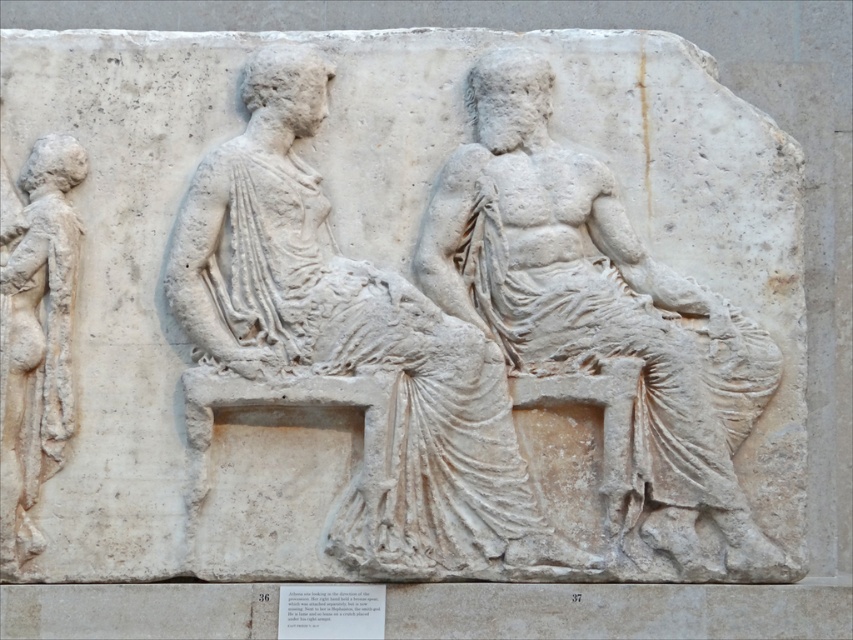
Who is lower down, white marble reclining figure at center or white marble figure at left?

white marble figure at left

Looking at this image, is white marble reclining figure at center to the left of white marble figure at left from the viewer's perspective?

No, white marble reclining figure at center is not to the left of white marble figure at left.

The height and width of the screenshot is (640, 853). What do you see at coordinates (344, 346) in the screenshot?
I see `white marble reclining figure at center` at bounding box center [344, 346].

Find the location of a particular element. This screenshot has width=853, height=640. white marble reclining figure at center is located at coordinates (344, 346).

Who is higher up, white marble figure at center or white marble figure at left?

white marble figure at center is higher up.

Is white marble figure at center taller than white marble figure at left?

Correct, white marble figure at center is much taller as white marble figure at left.

Find the location of a particular element. white marble figure at center is located at coordinates (599, 314).

Locate an element on the screen. The height and width of the screenshot is (640, 853). white marble figure at center is located at coordinates (599, 314).

Is white marble reclining figure at center shorter than white marble figure at center?

In fact, white marble reclining figure at center may be taller than white marble figure at center.

Does white marble reclining figure at center have a lesser width compared to white marble figure at center?

In fact, white marble reclining figure at center might be wider than white marble figure at center.

Locate an element on the screen. Image resolution: width=853 pixels, height=640 pixels. white marble reclining figure at center is located at coordinates (344, 346).